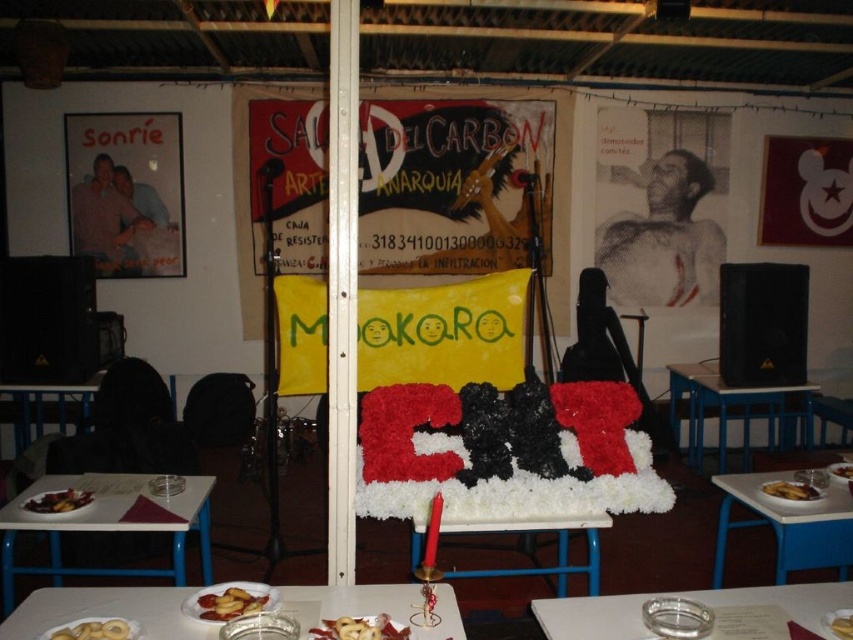
Does white plastic table at lower left lie in front of blue plastic table at center?

Yes.

Which is above, white plastic table at lower left or blue plastic table at center?

blue plastic table at center is higher up.

Where is `white plastic table at lower left`? This screenshot has height=640, width=853. white plastic table at lower left is located at coordinates (109, 524).

Does point (35, 593) lie behind point (241, 605)?

Yes.

Is translucent glass plate at lower center in front of slightly browned bread at lower center?

That is True.

The width and height of the screenshot is (853, 640). Find the location of `translucent glass plate at lower center`. translucent glass plate at lower center is located at coordinates (108, 611).

What do you see at coordinates (698, 602) in the screenshot?
I see `clear glass ashtray at lower right` at bounding box center [698, 602].

Can you confirm if clear glass ashtray at lower right is positioned to the right of blue plastic table at center?

No, clear glass ashtray at lower right is not to the right of blue plastic table at center.

Is point (755, 604) more distant than point (791, 428)?

No, (755, 604) is in front of (791, 428).

Identify the location of clear glass ashtray at lower right. (698, 602).